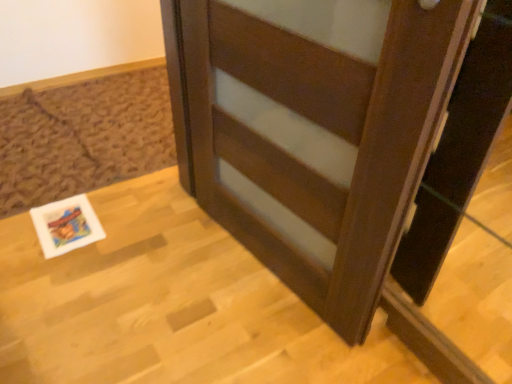
Question: Looking at the image, does white glossy postcard at lower left seem bigger or smaller compared to wooden table at center?

Choices:
 (A) small
 (B) big

Answer: (A)

Question: Which is correct: white glossy postcard at lower left is inside wooden table at center, or outside of it?

Choices:
 (A) outside
 (B) inside

Answer: (A)

Question: Estimate the real-world distances between objects in this image. Which object is closer to the white glossy postcard at lower left?

Choices:
 (A) wooden table at center
 (B) brown wood door at center

Answer: (A)

Question: Which object is the farthest from the white glossy postcard at lower left?

Choices:
 (A) wooden table at center
 (B) brown wood door at center

Answer: (B)